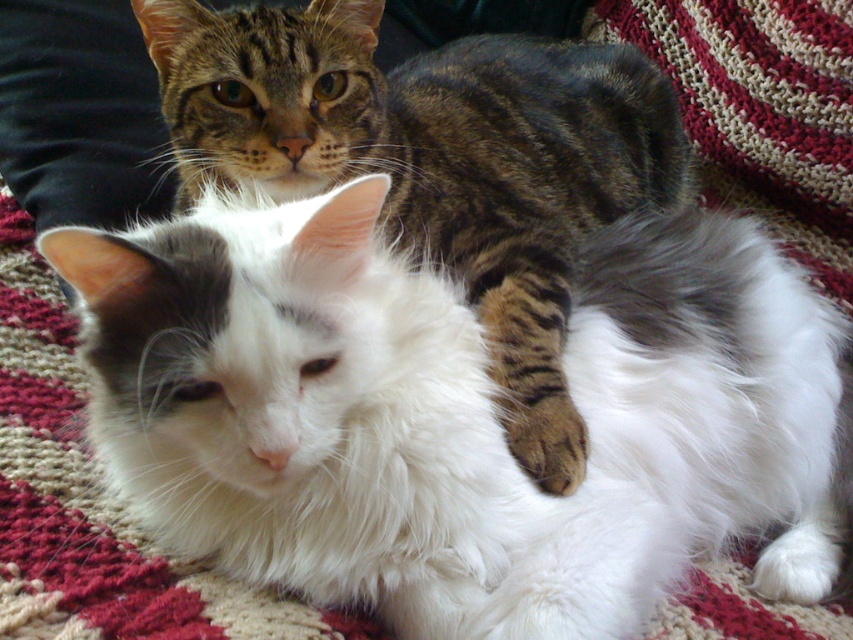
You are a photographer trying to capture a closeup of the white fluffy cat at center without including the tabby fur cat at upper center in the frame. Based on their positions, which direction should you move your camera to the left or right?

The tabby fur cat at upper center is to the right of the white fluffy cat at center. To exclude the tabby fur cat at upper center from the frame, move your camera to the right so that the white fluffy cat at center remains in view while the tabby fur cat at upper center moves out of the frame.

You are a photographer trying to capture a closeup shot of the tabby fur cat at upper center without the white fluffy cat at center blocking the view. Is this possible given their positions?

The tabby fur cat at upper center is in front of the white fluffy cat at center, so it is possible to take a closeup shot of the tabby fur cat at upper center without the white fluffy cat at center blocking the view since it is positioned in front.

You are a photographer setting up a camera to capture both cats in the scene. The camera frame can only accommodate the width of the white fluffy cat at center. Do you think the tabby fur cat at upper center will fit within the frame if you adjust the camera angle to include it?

The tabby fur cat at upper center might be wider than the white fluffy cat at center, so there is a possibility that it may not fit within the camera frame designed for the width of the white fluffy cat at center. Adjusting the angle might help, but it could still be too wide.